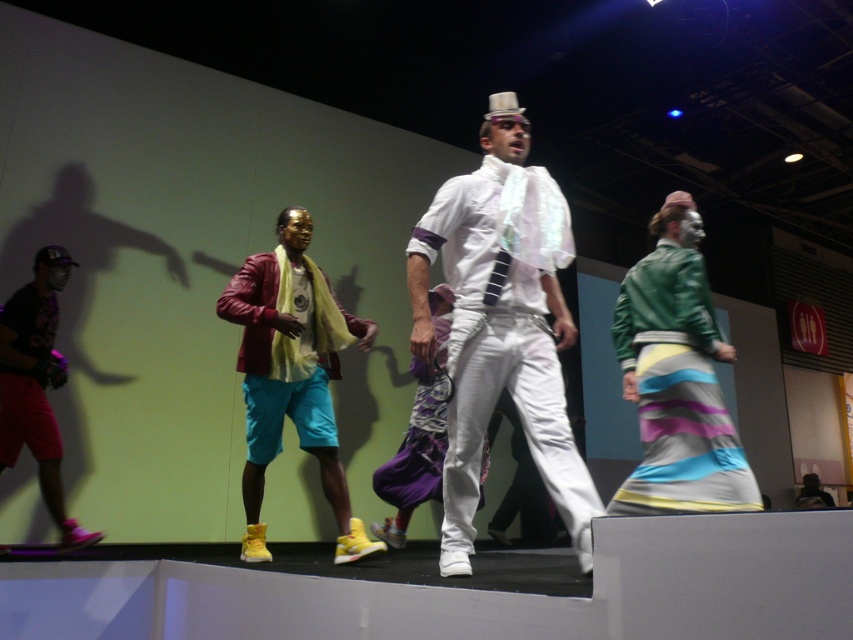
Question: Can you confirm if white satin shirt at center is positioned to the left of green leather jacket at right?

Choices:
 (A) no
 (B) yes

Answer: (B)

Question: Can you confirm if green leather jacket at right is bigger than brushed metal baseball cap at left?

Choices:
 (A) yes
 (B) no

Answer: (A)

Question: Which of the following is the closest to the observer?

Choices:
 (A) matte leather jacket at center
 (B) white satin shirt at center
 (C) green leather jacket at right
 (D) brushed metal baseball cap at left

Answer: (B)

Question: Which of the following is the farthest from the observer?

Choices:
 (A) white satin shirt at center
 (B) matte leather jacket at center
 (C) brushed metal baseball cap at left

Answer: (C)

Question: Which point is closer to the camera taking this photo?

Choices:
 (A) (735, 451)
 (B) (41, 476)
 (C) (502, 358)
 (D) (314, 330)

Answer: (C)

Question: Does matte leather jacket at center appear on the left side of brushed metal baseball cap at left?

Choices:
 (A) no
 (B) yes

Answer: (A)